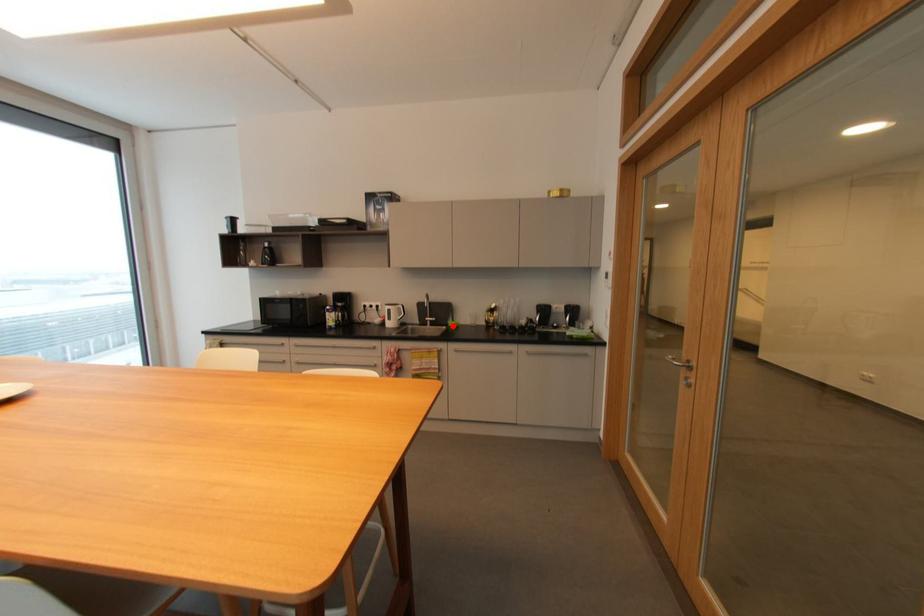
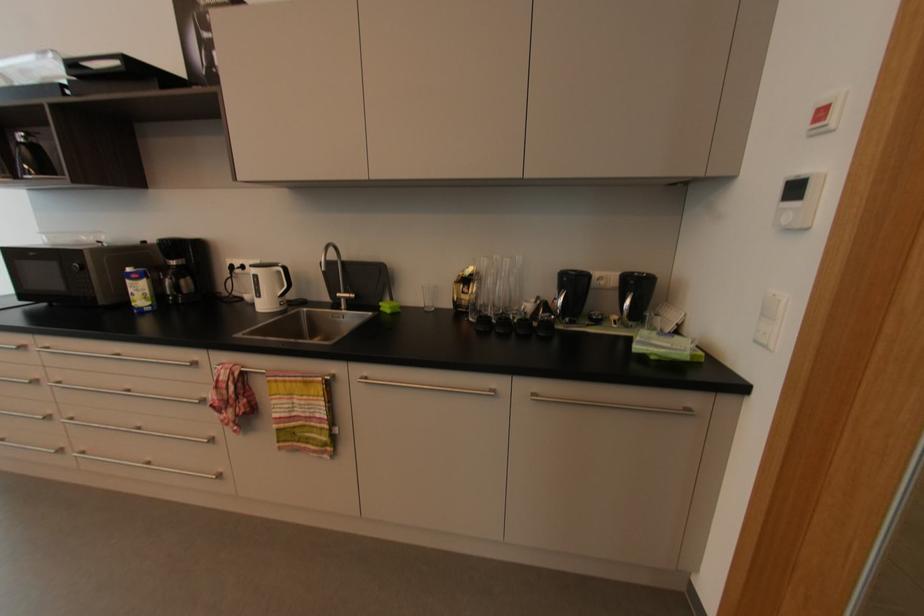
In the second image, find the point that corresponds to the highlighted location in the first image.

(384, 309)